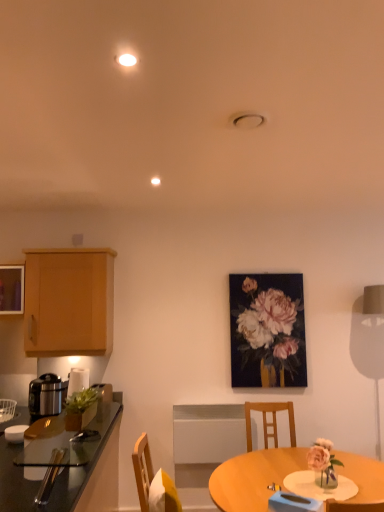
Question: Is matte black table lamp at right not within light brown wood cabinet at left?

Choices:
 (A) yes
 (B) no

Answer: (A)

Question: Considering the relative sizes of matte black table lamp at right and light brown wood cabinet at left in the image provided, is matte black table lamp at right thinner than light brown wood cabinet at left?

Choices:
 (A) no
 (B) yes

Answer: (B)

Question: Can you confirm if matte black table lamp at right is bigger than light brown wood cabinet at left?

Choices:
 (A) no
 (B) yes

Answer: (A)

Question: From a real-world perspective, is matte black table lamp at right physically above light brown wood cabinet at left?

Choices:
 (A) no
 (B) yes

Answer: (A)

Question: Considering the relative sizes of matte black table lamp at right and light brown wood cabinet at left in the image provided, is matte black table lamp at right shorter than light brown wood cabinet at left?

Choices:
 (A) no
 (B) yes

Answer: (A)

Question: From the image's perspective, is metallic silver rice cooker at left located above or below shiny black countertop at left?

Choices:
 (A) below
 (B) above

Answer: (B)

Question: From their relative heights in the image, would you say metallic silver rice cooker at left is taller or shorter than shiny black countertop at left?

Choices:
 (A) tall
 (B) short

Answer: (B)

Question: Is metallic silver rice cooker at left wider or thinner than shiny black countertop at left?

Choices:
 (A) wide
 (B) thin

Answer: (B)

Question: Considering the positions of point (34, 401) and point (21, 470), is point (34, 401) closer or farther from the camera than point (21, 470)?

Choices:
 (A) farther
 (B) closer

Answer: (A)

Question: Considering their positions, is metallic silver rice cooker at left located in front of or behind light wood table at center?

Choices:
 (A) front
 (B) behind

Answer: (B)

Question: Would you say metallic silver rice cooker at left is to the left or to the right of light wood table at center in the picture?

Choices:
 (A) left
 (B) right

Answer: (A)

Question: From a real-world perspective, is metallic silver rice cooker at left physically located above or below light wood table at center?

Choices:
 (A) above
 (B) below

Answer: (A)

Question: Is metallic silver rice cooker at left spatially inside light wood table at center, or outside of it?

Choices:
 (A) outside
 (B) inside

Answer: (A)

Question: Choose the correct answer: Is light wood table at center inside metallic silver rice cooker at left or outside it?

Choices:
 (A) outside
 (B) inside

Answer: (A)

Question: From a real-world perspective, is light wood table at center above or below metallic silver rice cooker at left?

Choices:
 (A) below
 (B) above

Answer: (A)